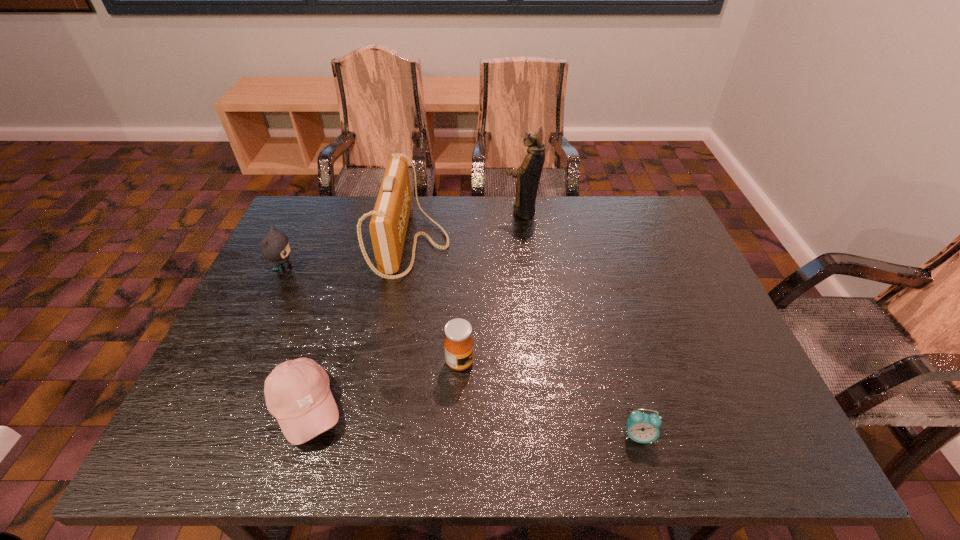
Locate an element on the screen. The width and height of the screenshot is (960, 540). vacant space that's between the alarm clock and the second tallest object is located at coordinates (525, 340).

You are a GUI agent. You are given a task and a screenshot of the screen. Output one action in this format:
    pyautogui.click(x=<x>, y=<y>)
    Task: Click on the free space between the baseball cap and the second tallest object
    This screenshot has width=960, height=540.
    Given the screenshot: What is the action you would take?
    pyautogui.click(x=359, y=326)

Locate an element on the screen. The image size is (960, 540). free point between the leftmost object and the fifth tallest object is located at coordinates (296, 339).

The height and width of the screenshot is (540, 960). What are the coordinates of `vacant area between the handbag and the kitten` in the screenshot? It's located at (348, 256).

At what (x,y) coordinates should I click in order to perform the action: click on free space between the handbag and the fifth tallest object. Please return your answer as a coordinate pair (x, y). The image size is (960, 540). Looking at the image, I should click on (359, 326).

Locate an element on the screen. This screenshot has width=960, height=540. free space between the handbag and the kitten is located at coordinates (348, 256).

Select which object is the closest to the rightmost object. Please provide its 2D coordinates. Your answer should be formatted as a tuple, i.e. [(x, y)], where the tuple contains the x and y coordinates of a point satisfying the conditions above.

[(458, 344)]

Point out which object is positioned as the fifth nearest to the handbag. Please provide its 2D coordinates. Your answer should be formatted as a tuple, i.e. [(x, y)], where the tuple contains the x and y coordinates of a point satisfying the conditions above.

[(643, 428)]